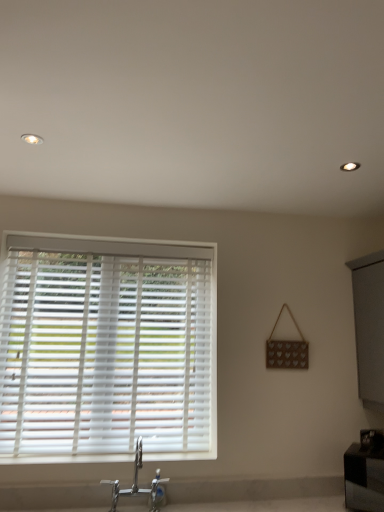
Question: From a real-world perspective, does white plastic blinds at left stand above black glossy vanity at lower right?

Choices:
 (A) yes
 (B) no

Answer: (A)

Question: Is white plastic blinds at left positioned before black glossy vanity at lower right?

Choices:
 (A) yes
 (B) no

Answer: (B)

Question: Are white plastic blinds at left and black glossy vanity at lower right located far from each other?

Choices:
 (A) no
 (B) yes

Answer: (B)

Question: Does white plastic blinds at left have a lesser height compared to black glossy vanity at lower right?

Choices:
 (A) no
 (B) yes

Answer: (A)

Question: From a real-world perspective, is white plastic blinds at left located beneath black glossy vanity at lower right?

Choices:
 (A) yes
 (B) no

Answer: (B)

Question: From a real-world perspective, is white plastic blinds at left above or below chrome metallic faucet at lower center?

Choices:
 (A) above
 (B) below

Answer: (A)

Question: Is white plastic blinds at left bigger or smaller than chrome metallic faucet at lower center?

Choices:
 (A) big
 (B) small

Answer: (A)

Question: Is white plastic blinds at left in front of or behind chrome metallic faucet at lower center in the image?

Choices:
 (A) front
 (B) behind

Answer: (B)

Question: From their relative heights in the image, would you say white plastic blinds at left is taller or shorter than chrome metallic faucet at lower center?

Choices:
 (A) tall
 (B) short

Answer: (A)

Question: Looking at their shapes, would you say white plastic blinds at left is wider or thinner than black glossy vanity at lower right?

Choices:
 (A) thin
 (B) wide

Answer: (A)

Question: Considering their positions, is white plastic blinds at left located in front of or behind black glossy vanity at lower right?

Choices:
 (A) behind
 (B) front

Answer: (A)

Question: From a real-world perspective, is white plastic blinds at left positioned above or below black glossy vanity at lower right?

Choices:
 (A) above
 (B) below

Answer: (A)

Question: From the image's perspective, is white plastic blinds at left above or below black glossy vanity at lower right?

Choices:
 (A) above
 (B) below

Answer: (A)

Question: Considering the positions of chrome metallic faucet at lower center and white plastic blinds at left in the image, is chrome metallic faucet at lower center taller or shorter than white plastic blinds at left?

Choices:
 (A) short
 (B) tall

Answer: (A)

Question: Is point (135, 448) positioned closer to the camera than point (33, 315)?

Choices:
 (A) farther
 (B) closer

Answer: (B)